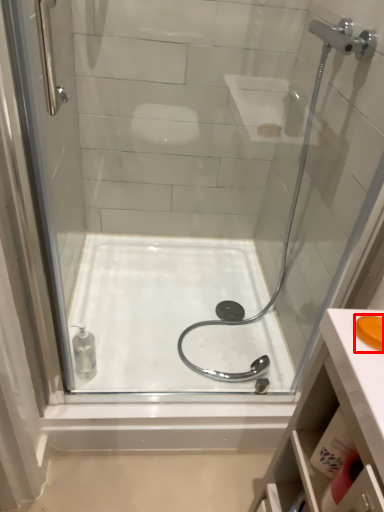
Question: From the image's perspective, considering the relative positions of soap (annotated by the red box) and bath in the image provided, where is soap (annotated by the red box) located with respect to the staircase?

Choices:
 (A) above
 (B) below

Answer: (A)